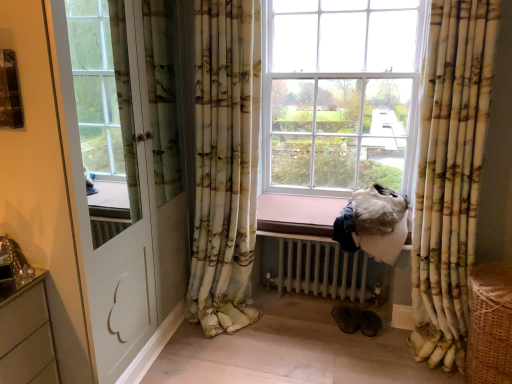
What do you see at coordinates (450, 174) in the screenshot? The image size is (512, 384). I see `floral fabric curtain at right, which is counted as the 1th curtain, starting from the right` at bounding box center [450, 174].

The height and width of the screenshot is (384, 512). Identify the location of white glossy door at left. (128, 162).

Measure the distance between floral fabric curtain at center, acting as the second curtain starting from the right, and floral fabric curtain at right, the second curtain in the left-to-right sequence.

floral fabric curtain at center, acting as the second curtain starting from the right, is 1.02 meters away from floral fabric curtain at right, the second curtain in the left-to-right sequence.

Is floral fabric curtain at center, arranged as the 1th curtain when viewed from the left, positioned with its back to floral fabric curtain at right, which is counted as the 1th curtain, starting from the right?

No, floral fabric curtain at center, arranged as the 1th curtain when viewed from the left,'s orientation is not away from floral fabric curtain at right, which is counted as the 1th curtain, starting from the right.

Is point (226, 138) closer or farther from the camera than point (440, 314)?

Point (226, 138).

Is floral fabric curtain at center, arranged as the 1th curtain when viewed from the left, to the left of floral fabric curtain at right, the second curtain in the left-to-right sequence, from the viewer's perspective?

Correct, you'll find floral fabric curtain at center, arranged as the 1th curtain when viewed from the left, to the left of floral fabric curtain at right, the second curtain in the left-to-right sequence.

Could you tell me if floral fabric curtain at right, which is counted as the 1th curtain, starting from the right, is turned towards brown woven basket at lower right?

No, floral fabric curtain at right, which is counted as the 1th curtain, starting from the right, is not facing towards brown woven basket at lower right.

Can you confirm if floral fabric curtain at right, the second curtain in the left-to-right sequence, is positioned to the right of brown woven basket at lower right?

No.

From a real-world perspective, between floral fabric curtain at right, the second curtain in the left-to-right sequence, and brown woven basket at lower right, who is vertically higher?

floral fabric curtain at right, the second curtain in the left-to-right sequence, is physically above.

Is floral fabric curtain at right, the second curtain in the left-to-right sequence, far from brown woven basket at lower right?

Actually, floral fabric curtain at right, the second curtain in the left-to-right sequence, and brown woven basket at lower right are a little close together.

How many degrees apart are the facing directions of white painted metal radiator at lower center and brown woven basket at lower right?

90.3 degrees separate the facing orientations of white painted metal radiator at lower center and brown woven basket at lower right.

Is white painted metal radiator at lower center at the left side of brown woven basket at lower right?

Yes, white painted metal radiator at lower center is to the left of brown woven basket at lower right.

The width and height of the screenshot is (512, 384). Find the location of `basket that is in front of the white painted metal radiator at lower center`. basket that is in front of the white painted metal radiator at lower center is located at coordinates (490, 324).

Based on the photo, could you tell me if white painted metal radiator at lower center is facing brown woven basket at lower right?

No, white painted metal radiator at lower center is not oriented towards brown woven basket at lower right.

Between white glossy door at left and white painted metal radiator at lower center, which one has larger width?

white painted metal radiator at lower center is wider.

Does white glossy door at left have a lesser height compared to white painted metal radiator at lower center?

In fact, white glossy door at left may be taller than white painted metal radiator at lower center.

Looking at this image, can you confirm if white glossy door at left is positioned to the right of white painted metal radiator at lower center?

No, white glossy door at left is not to the right of white painted metal radiator at lower center.

Is white painted metal radiator at lower center far away from white glossy door at left?

white painted metal radiator at lower center is near white glossy door at left, not far away.

Could you tell me if white painted metal radiator at lower center is facing white glossy door at left?

No, white painted metal radiator at lower center is not oriented towards white glossy door at left.

What's the angular difference between white painted metal radiator at lower center and white glossy door at left's facing directions?

They differ by 176 degrees in their facing directions.

Is white painted metal radiator at lower center completely or partially outside of white glossy door at left?

Indeed, white painted metal radiator at lower center is completely outside white glossy door at left.

Measure the distance between floral fabric curtain at center, arranged as the 1th curtain when viewed from the left, and white painted metal radiator at lower center.

floral fabric curtain at center, arranged as the 1th curtain when viewed from the left, is 21.78 inches away from white painted metal radiator at lower center.

From a real-world perspective, is floral fabric curtain at center, arranged as the 1th curtain when viewed from the left, positioned under white painted metal radiator at lower center based on gravity?

No, from a real-world perspective, floral fabric curtain at center, arranged as the 1th curtain when viewed from the left, is not below white painted metal radiator at lower center.

Considering the relative sizes of floral fabric curtain at center, arranged as the 1th curtain when viewed from the left, and white painted metal radiator at lower center in the image provided, is floral fabric curtain at center, arranged as the 1th curtain when viewed from the left, taller than white painted metal radiator at lower center?

Indeed, floral fabric curtain at center, arranged as the 1th curtain when viewed from the left, has a greater height compared to white painted metal radiator at lower center.

You are a GUI agent. You are given a task and a screenshot of the screen. Output one action in this format:
    pyautogui.click(x=<x>, y=<y>)
    Task: Click on the curtain that is the 2nd one when counting upward from the white painted metal radiator at lower center (from the image's perspective)
    
    Given the screenshot: What is the action you would take?
    pyautogui.click(x=223, y=167)

Who is bigger, floral fabric curtain at center, arranged as the 1th curtain when viewed from the left, or white glossy door at left?

white glossy door at left is bigger.

How different are the orientations of floral fabric curtain at center, acting as the second curtain starting from the right, and white glossy door at left in degrees?

89.6 degrees.

Is floral fabric curtain at center, acting as the second curtain starting from the right, touching white glossy door at left?

There is a gap between floral fabric curtain at center, acting as the second curtain starting from the right, and white glossy door at left.

In the scene shown: From the image's perspective, is floral fabric curtain at center, arranged as the 1th curtain when viewed from the left, positioned above or below white glossy door at left?

From the image's perspective, floral fabric curtain at center, arranged as the 1th curtain when viewed from the left, appears above white glossy door at left.

The height and width of the screenshot is (384, 512). Identify the location of curtain that is above the floral fabric curtain at right, the second curtain in the left-to-right sequence (from the image's perspective). click(223, 167).

Image resolution: width=512 pixels, height=384 pixels. I want to click on basket lying behind the floral fabric curtain at right, which is counted as the 1th curtain, starting from the right, so click(490, 324).

From the image, which object appears to be nearer to floral fabric curtain at right, which is counted as the 1th curtain, starting from the right, white painted metal radiator at lower center or floral fabric curtain at center, arranged as the 1th curtain when viewed from the left?

white painted metal radiator at lower center lies closer to floral fabric curtain at right, which is counted as the 1th curtain, starting from the right, than the other object.

When comparing their distances from floral fabric curtain at right, which is counted as the 1th curtain, starting from the right, does floral fabric curtain at center, acting as the second curtain starting from the right, or brown woven basket at lower right seem further?

floral fabric curtain at center, acting as the second curtain starting from the right.

Looking at the image, which one is located further to white painted metal radiator at lower center, floral fabric curtain at right, the second curtain in the left-to-right sequence, or brown woven basket at lower right?

The object further to white painted metal radiator at lower center is brown woven basket at lower right.

When comparing their distances from floral fabric curtain at center, acting as the second curtain starting from the right, does white painted metal radiator at lower center or floral fabric curtain at right, the second curtain in the left-to-right sequence, seem further?

The object further to floral fabric curtain at center, acting as the second curtain starting from the right, is floral fabric curtain at right, the second curtain in the left-to-right sequence.

When comparing their distances from floral fabric curtain at center, acting as the second curtain starting from the right, does brown woven basket at lower right or white glossy door at left seem closer?

Among the two, white glossy door at left is located nearer to floral fabric curtain at center, acting as the second curtain starting from the right.

Looking at the image, which one is located further to white painted metal radiator at lower center, brown woven basket at lower right or white glossy door at left?

white glossy door at left.

Estimate the real-world distances between objects in this image. Which object is closer to floral fabric curtain at right, the second curtain in the left-to-right sequence, white glossy door at left or white painted metal radiator at lower center?

The object closer to floral fabric curtain at right, the second curtain in the left-to-right sequence, is white painted metal radiator at lower center.

Estimate the real-world distances between objects in this image. Which object is closer to brown woven basket at lower right, white glossy door at left or floral fabric curtain at center, arranged as the 1th curtain when viewed from the left?

Based on the image, floral fabric curtain at center, arranged as the 1th curtain when viewed from the left, appears to be nearer to brown woven basket at lower right.

This screenshot has height=384, width=512. Find the location of `radiator located between floral fabric curtain at center, arranged as the 1th curtain when viewed from the left, and floral fabric curtain at right, the second curtain in the left-to-right sequence, in the left-right direction`. radiator located between floral fabric curtain at center, arranged as the 1th curtain when viewed from the left, and floral fabric curtain at right, the second curtain in the left-to-right sequence, in the left-right direction is located at coordinates (327, 269).

Find the location of a particular element. basket located between floral fabric curtain at right, the second curtain in the left-to-right sequence, and white painted metal radiator at lower center in the depth direction is located at coordinates (490, 324).

Identify the location of curtain between white glossy door at left and floral fabric curtain at right, which is counted as the 1th curtain, starting from the right, in the horizontal direction. The width and height of the screenshot is (512, 384). (223, 167).

I want to click on radiator between white glossy door at left and floral fabric curtain at right, which is counted as the 1th curtain, starting from the right, in the horizontal direction, so click(x=327, y=269).